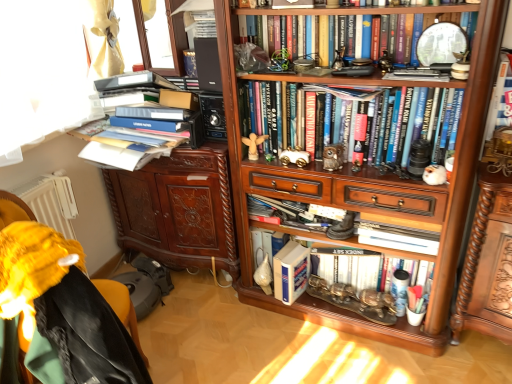
In order to click on vacant position to the left of wooden bookcase at center in this screenshot , I will do `click(227, 336)`.